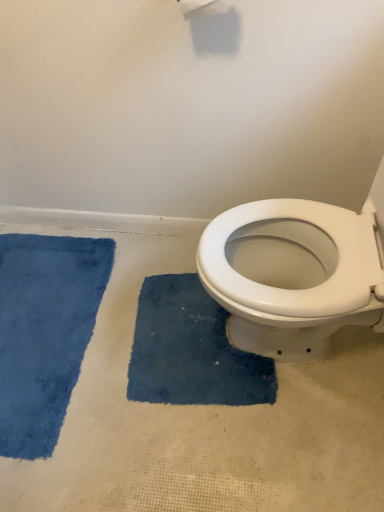
This screenshot has width=384, height=512. In order to click on blank space to the left of blue plush bath mat at center, the first bath mat positioned from the right in this screenshot , I will do `click(100, 370)`.